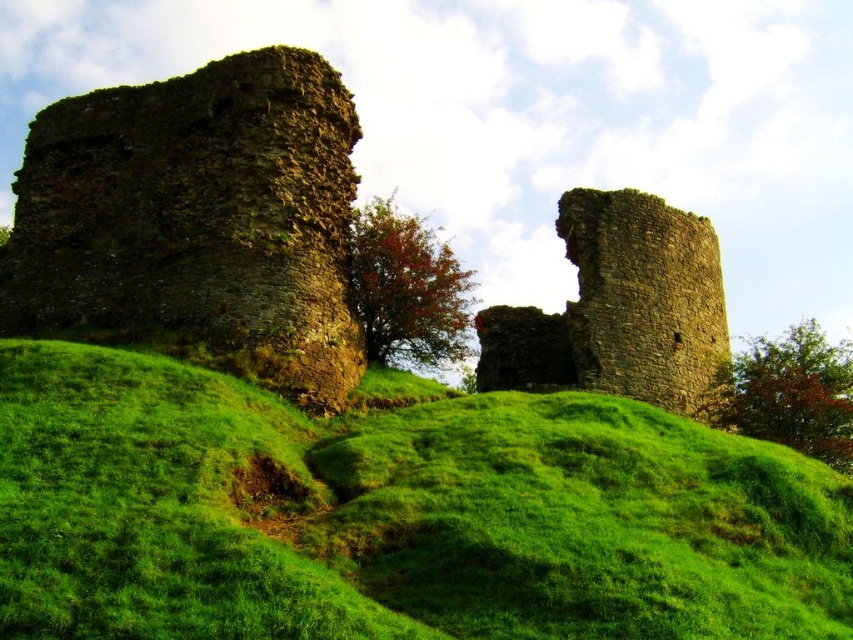
Is green grassy hillside at center closer to the viewer compared to rustic stone castle at upper left?

Yes, green grassy hillside at center is in front of rustic stone castle at upper left.

Is point (281, 524) in front of point (144, 99)?

That is True.

Describe the element at coordinates (393, 513) in the screenshot. I see `green grassy hillside at center` at that location.

Locate an element on the screen. This screenshot has height=640, width=853. green grassy hillside at center is located at coordinates (393, 513).

Does rusty stone tower at left lie in front of rusty stone tower at center?

Yes.

Does point (79, 237) come in front of point (524, 317)?

Yes, it is.

Image resolution: width=853 pixels, height=640 pixels. Identify the location of rusty stone tower at left. (196, 221).

Who is positioned more to the right, rustic stone castle at upper left or rusty stone tower at center?

rusty stone tower at center is more to the right.

Which of these two, rustic stone castle at upper left or rusty stone tower at center, stands taller?

Standing taller between the two is rustic stone castle at upper left.

Identify the location of rustic stone castle at upper left. This screenshot has width=853, height=640. (198, 220).

You are a GUI agent. You are given a task and a screenshot of the screen. Output one action in this format:
    pyautogui.click(x=<x>, y=<y>)
    Task: Click on the rustic stone castle at upper left
    The width and height of the screenshot is (853, 640).
    Given the screenshot: What is the action you would take?
    pyautogui.click(x=198, y=220)